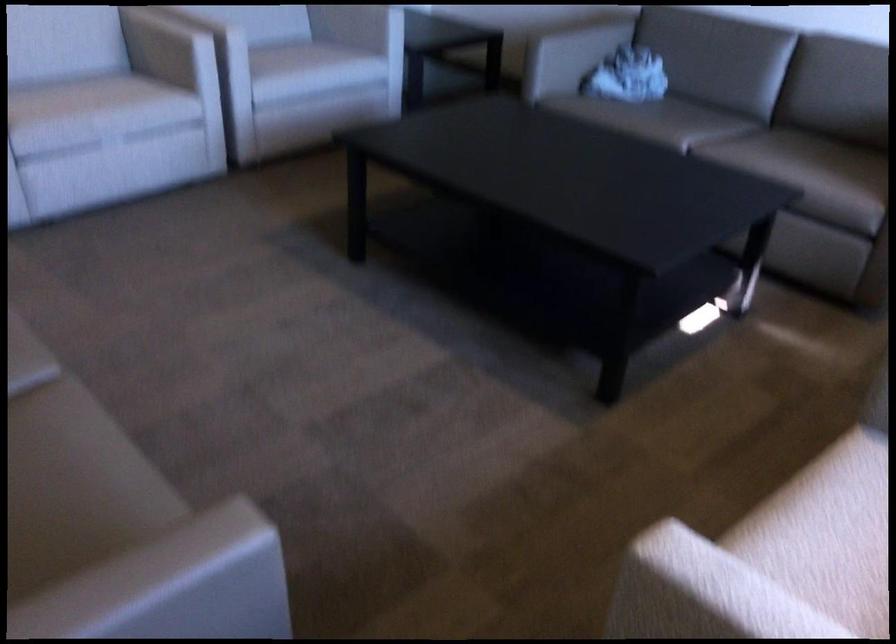
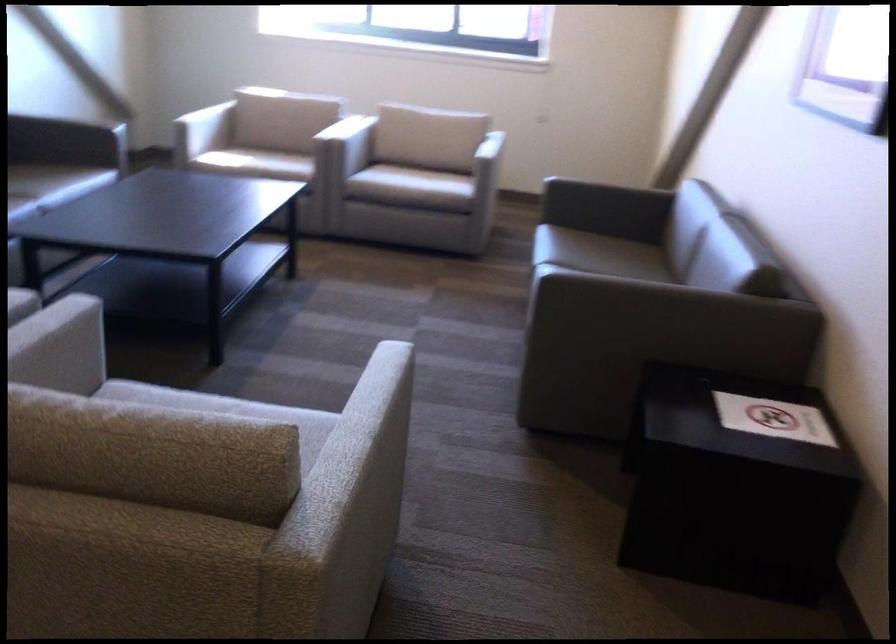
The point at (245,287) is marked in the first image. Where is the corresponding point in the second image?

(279, 406)